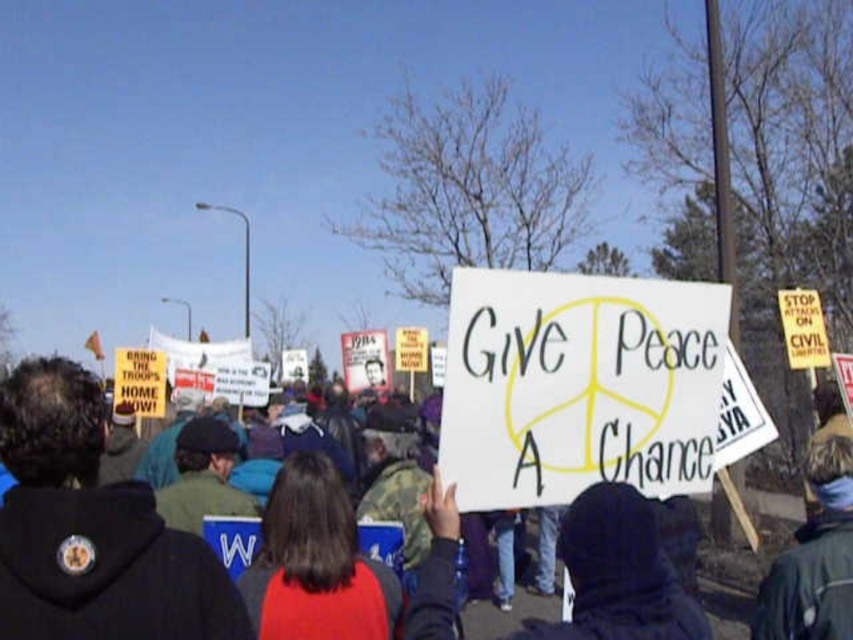
Question: Among these objects, which one is nearest to the camera?

Choices:
 (A) white paper sign at center
 (B) dark blue hoodie at center

Answer: (B)

Question: Which point is closer to the camera?

Choices:
 (A) (196, 573)
 (B) (503, 397)

Answer: (A)

Question: Can you confirm if white paper sign at center is thinner than dark blue hoodie at center?

Choices:
 (A) no
 (B) yes

Answer: (A)

Question: Which object is closer to the camera taking this photo?

Choices:
 (A) dark blue hoodie at center
 (B) white paper sign at center

Answer: (A)

Question: Does white paper sign at center lie behind dark blue hoodie at center?

Choices:
 (A) yes
 (B) no

Answer: (A)

Question: Does white paper sign at center have a larger size compared to dark blue hoodie at center?

Choices:
 (A) no
 (B) yes

Answer: (B)